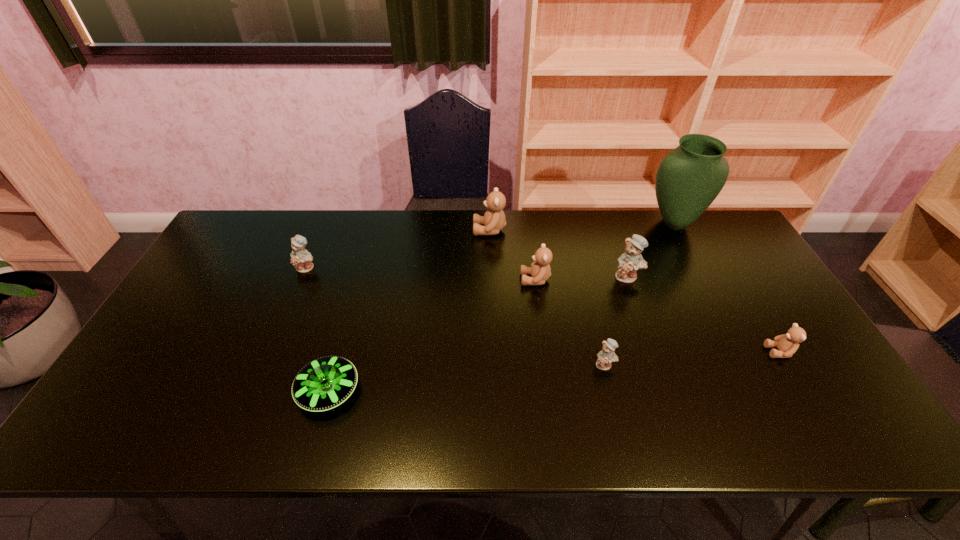
The image size is (960, 540). In order to click on the smallest brown teddy bear in this screenshot , I will do `click(787, 344)`.

Where is `the rightmost brown teddy bear`? the rightmost brown teddy bear is located at coordinates (787, 344).

Image resolution: width=960 pixels, height=540 pixels. In order to click on the fifth object from left to right in this screenshot , I will do click(606, 356).

Where is `the third teddy bear from right to left`? the third teddy bear from right to left is located at coordinates (606, 356).

I want to click on green saucer, so click(x=325, y=383).

Where is `saucer`? The image size is (960, 540). saucer is located at coordinates (325, 383).

Identify the location of free space located on the front of the green vase. The image size is (960, 540). (712, 297).

Where is `vacant space positioned on the face of the leftmost brown teddy bear`? The image size is (960, 540). vacant space positioned on the face of the leftmost brown teddy bear is located at coordinates (449, 230).

This screenshot has width=960, height=540. I want to click on free region located 0.340m on the face of the leftmost brown teddy bear, so click(373, 230).

Locate an element on the screen. Image resolution: width=960 pixels, height=540 pixels. free space located on the face of the leftmost brown teddy bear is located at coordinates pyautogui.click(x=368, y=230).